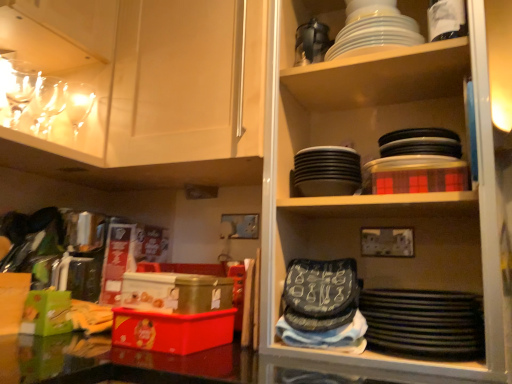
In order to face matte white cabinet at upper left, should I rotate leftwards or rightwards?

Rotate left and turn 15.016 degrees.

This screenshot has height=384, width=512. What do you see at coordinates (17, 88) in the screenshot? I see `clear glass wine glasses at upper left, which ranks as the first tableware in left-to-right order` at bounding box center [17, 88].

What do you see at coordinates (44, 104) in the screenshot? I see `clear glass wine glasses at upper left, acting as the third tableware starting from the right` at bounding box center [44, 104].

Image resolution: width=512 pixels, height=384 pixels. What do you see at coordinates (381, 182) in the screenshot? I see `black matte plates at upper right` at bounding box center [381, 182].

Locate an element on the screen. This screenshot has width=512, height=384. black matte plates at upper right is located at coordinates (381, 182).

Where is `matte plastic box at lower left`? The width and height of the screenshot is (512, 384). matte plastic box at lower left is located at coordinates click(x=172, y=330).

The width and height of the screenshot is (512, 384). Find the location of `matte white cabinet at upper left`. matte white cabinet at upper left is located at coordinates (137, 79).

Is clear glass wine glasses at upper left, which is the second tableware from left to right, aimed at black matte plates at upper center, positioned as the 2th tableware in right-to-left order?

No.

From the image's perspective, which is above, clear glass wine glasses at upper left, which is the second tableware from left to right, or black matte plates at upper center, positioned as the 2th tableware in right-to-left order?

clear glass wine glasses at upper left, which is the second tableware from left to right.

This screenshot has width=512, height=384. I want to click on tableware that is the 2nd one above the black matte plates at upper center, the third tableware viewed from the left (from a real-world perspective), so click(x=44, y=104).

Which of these two, clear glass wine glasses at upper left, acting as the third tableware starting from the right, or black matte plates at upper center, the third tableware viewed from the left, is smaller?

With smaller size is clear glass wine glasses at upper left, acting as the third tableware starting from the right.

Which is further, (218, 314) or (22, 47)?

Positioned behind is point (22, 47).

From the image's perspective, between matte plastic box at lower left and matte white cabinet at upper left, who is located below?

matte plastic box at lower left.

Is matte plastic box at lower left facing away from matte white cabinet at upper left?

That's not correct — matte plastic box at lower left is not looking away from matte white cabinet at upper left.

Which object is more forward, clear glass wine glasses at upper left, which ranks as the first tableware in left-to-right order, or matte white cabinet at upper left?

Positioned in front is matte white cabinet at upper left.

From a real-world perspective, which tableware is the 3rd one underneath the matte white cabinet at upper left? Please provide its 2D coordinates.

[(17, 88)]

Based on their positions, is clear glass wine glasses at upper left, which ranks as the first tableware in left-to-right order, located to the left or right of matte white cabinet at upper left?

clear glass wine glasses at upper left, which ranks as the first tableware in left-to-right order, is to the left of matte white cabinet at upper left.

Is clear glass wine glasses at upper left, which ranks as the first tableware in left-to-right order, bigger or smaller than matte white cabinet at upper left?

Considering their sizes, clear glass wine glasses at upper left, which ranks as the first tableware in left-to-right order, takes up less space than matte white cabinet at upper left.

From the image's perspective, is black matte plates at upper right under black matte plates at upper center, the third tableware viewed from the left?

No, from the image's perspective, black matte plates at upper right is not beneath black matte plates at upper center, the third tableware viewed from the left.

Does black matte plates at upper right touch black matte plates at upper center, the third tableware viewed from the left?

No, black matte plates at upper right is not touching black matte plates at upper center, the third tableware viewed from the left.

In the scene shown: Between black matte plates at upper right and black matte plates at upper center, the third tableware viewed from the left, which one has more height?

black matte plates at upper right is taller.

Which of these two, black matte plates at upper right or black matte plates at upper center, positioned as the 2th tableware in right-to-left order, is thinner?

black matte plates at upper center, positioned as the 2th tableware in right-to-left order.

Considering their positions, is white glossy plates at upper center, positioned as the 4th tableware in left-to-right order, located in front of or behind black matte plates at upper right?

Clearly, white glossy plates at upper center, positioned as the 4th tableware in left-to-right order, is behind black matte plates at upper right.

Is white glossy plates at upper center, the 1th tableware positioned from the right, positioned far away from black matte plates at upper right?

No.

Who is bigger, white glossy plates at upper center, the 1th tableware positioned from the right, or black matte plates at upper right?

black matte plates at upper right is bigger.

Is white glossy plates at upper center, the 1th tableware positioned from the right, wider than black matte plates at upper right?

No.

Considering the sizes of objects white glossy plates at upper center, positioned as the 4th tableware in left-to-right order, and matte white cabinet at upper left in the image provided, who is thinner, white glossy plates at upper center, positioned as the 4th tableware in left-to-right order, or matte white cabinet at upper left?

Thinner between the two is white glossy plates at upper center, positioned as the 4th tableware in left-to-right order.

In terms of size, does white glossy plates at upper center, the 1th tableware positioned from the right, appear bigger or smaller than matte white cabinet at upper left?

Clearly, white glossy plates at upper center, the 1th tableware positioned from the right, is smaller in size than matte white cabinet at upper left.

Is white glossy plates at upper center, the 1th tableware positioned from the right, positioned with its back to matte white cabinet at upper left?

white glossy plates at upper center, the 1th tableware positioned from the right, is not turned away from matte white cabinet at upper left.

Is black matte plates at upper right facing towards matte plastic box at lower left?

No.

How many degrees apart are the facing directions of black matte plates at upper right and matte plastic box at lower left?

black matte plates at upper right and matte plastic box at lower left are facing 5.24 degrees away from each other.

What are the coordinates of `box lying on the left of black matte plates at upper right` in the screenshot? It's located at (172, 330).

Considering the sizes of objects black matte plates at upper right and matte plastic box at lower left in the image provided, who is smaller, black matte plates at upper right or matte plastic box at lower left?

With smaller size is matte plastic box at lower left.

The height and width of the screenshot is (384, 512). I want to click on the 1st tableware above when counting from the black matte plates at upper center, the third tableware viewed from the left (from the image's perspective), so click(x=44, y=104).

I want to click on box to the right of matte white cabinet at upper left, so click(172, 330).

Which object lies nearer to the anchor point black matte platter at lower right, clear glass wine glasses at upper left, which is the second tableware from left to right, or clear glass wine glasses at upper left, which ranks as the first tableware in left-to-right order?

Among the two, clear glass wine glasses at upper left, which is the second tableware from left to right, is located nearer to black matte platter at lower right.

From the image, which object appears to be nearer to black matte plates at upper center, the third tableware viewed from the left, matte plastic box at lower left or black matte plates at upper right?

black matte plates at upper right.

Consider the image. Looking at the image, which one is located closer to black matte plates at upper right, clear glass wine glasses at upper left, marked as the fourth tableware in a right-to-left arrangement, or clear glass wine glasses at upper left, which is the second tableware from left to right?

clear glass wine glasses at upper left, which is the second tableware from left to right, is positioned closer to the anchor black matte plates at upper right.

Considering their positions, is black matte plates at upper center, the third tableware viewed from the left, positioned further to matte plastic box at lower left than white glossy plates at upper center, positioned as the 4th tableware in left-to-right order?

Based on the image, white glossy plates at upper center, positioned as the 4th tableware in left-to-right order, appears to be further to matte plastic box at lower left.

Considering their positions, is matte plastic box at lower left positioned further to clear glass wine glasses at upper left, which ranks as the first tableware in left-to-right order, than black matte platter at lower right?

Among the two, black matte platter at lower right is located further to clear glass wine glasses at upper left, which ranks as the first tableware in left-to-right order.

When comparing their distances from clear glass wine glasses at upper left, which is the second tableware from left to right, does white glossy plates at upper center, the 1th tableware positioned from the right, or matte plastic box at lower left seem further?

Based on the image, white glossy plates at upper center, the 1th tableware positioned from the right, appears to be further to clear glass wine glasses at upper left, which is the second tableware from left to right.

From the picture: Based on their spatial positions, is clear glass wine glasses at upper left, which ranks as the first tableware in left-to-right order, or clear glass wine glasses at upper left, which is the second tableware from left to right, closer to matte plastic box at lower left?

clear glass wine glasses at upper left, which is the second tableware from left to right.

From the picture: Considering their positions, is clear glass wine glasses at upper left, which ranks as the first tableware in left-to-right order, positioned further to matte white cabinet at upper left than matte plastic box at lower left?

matte plastic box at lower left is positioned further to the anchor matte white cabinet at upper left.

Where is `tableware between clear glass wine glasses at upper left, acting as the third tableware starting from the right, and white glossy plates at upper center, positioned as the 4th tableware in left-to-right order`? tableware between clear glass wine glasses at upper left, acting as the third tableware starting from the right, and white glossy plates at upper center, positioned as the 4th tableware in left-to-right order is located at coordinates (327, 171).

Find the location of `cabinetry located between clear glass wine glasses at upper left, acting as the third tableware starting from the right, and black matte platter at lower right in the left-right direction`. cabinetry located between clear glass wine glasses at upper left, acting as the third tableware starting from the right, and black matte platter at lower right in the left-right direction is located at coordinates (137, 79).

Locate an element on the screen. The image size is (512, 384). shelf between matte white cabinet at upper left and black matte platter at lower right is located at coordinates (381, 182).

Image resolution: width=512 pixels, height=384 pixels. What are the coordinates of `box situated between clear glass wine glasses at upper left, which ranks as the first tableware in left-to-right order, and white glossy plates at upper center, positioned as the 4th tableware in left-to-right order, from left to right` in the screenshot? It's located at (172, 330).